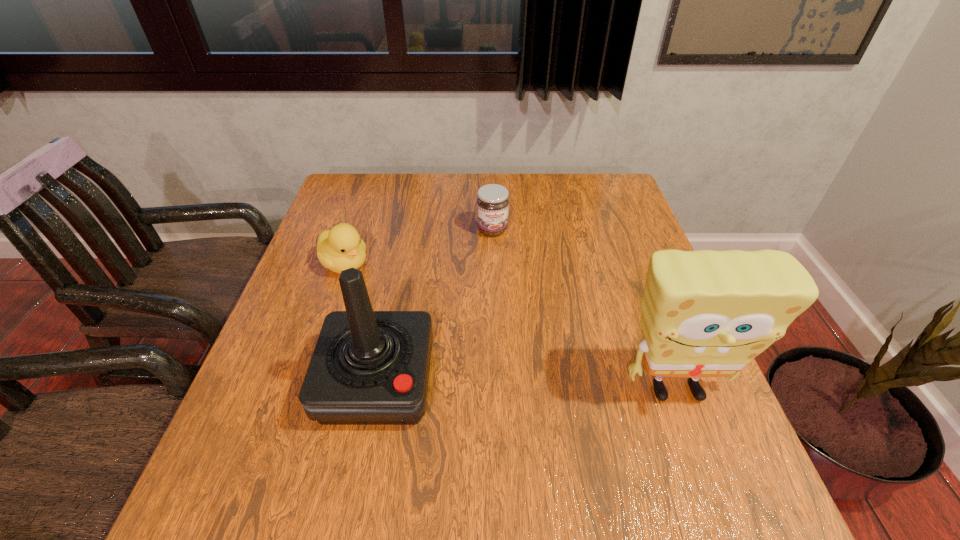
The width and height of the screenshot is (960, 540). Find the location of `joystick`. joystick is located at coordinates (368, 367).

This screenshot has width=960, height=540. I want to click on sponge, so click(x=704, y=313).

Locate an element on the screen. Image resolution: width=960 pixels, height=540 pixels. the farthest object is located at coordinates (492, 202).

This screenshot has width=960, height=540. I want to click on jam, so click(492, 202).

In order to click on duck in this screenshot , I will do `click(338, 249)`.

In order to click on blank space located 0.070m on the face of the rightmost object in this screenshot , I will do `click(701, 456)`.

This screenshot has height=540, width=960. I want to click on vacant space located on the front label of the farthest object, so click(537, 348).

Where is `free space located 0.320m on the front label of the farthest object`? free space located 0.320m on the front label of the farthest object is located at coordinates (528, 325).

Find the location of a particular element. free point located on the front label of the farthest object is located at coordinates (519, 302).

Find the location of a particular element. The width and height of the screenshot is (960, 540). vacant space located on the front-facing side of the second farthest object is located at coordinates (437, 326).